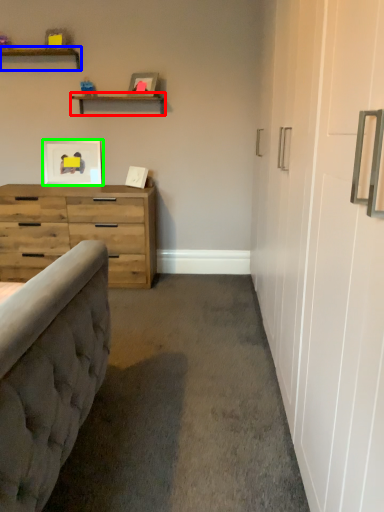
Question: Based on their relative distances, which object is farther from shelf (highlighted by a red box)? Choose from shelf (highlighted by a blue box) and picture frame (highlighted by a green box).

Choices:
 (A) shelf
 (B) picture frame

Answer: (B)